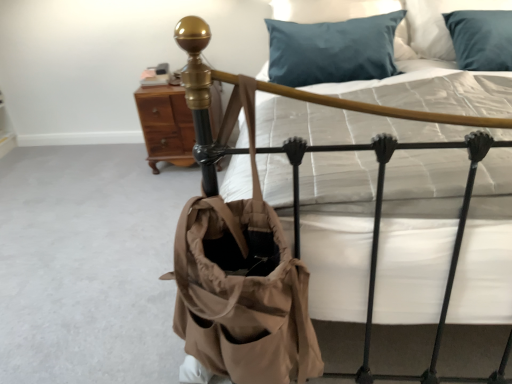
Question: Is brown wood nightstand at upper left inside the boundaries of white quilted mattress at center, or outside?

Choices:
 (A) inside
 (B) outside

Answer: (B)

Question: Considering the positions of brown wood nightstand at upper left and white quilted mattress at center in the image, is brown wood nightstand at upper left taller or shorter than white quilted mattress at center?

Choices:
 (A) tall
 (B) short

Answer: (B)

Question: Based on their relative distances, which object is farther from the tan canvas tote at center?

Choices:
 (A) white quilted mattress at center
 (B) teal satin pillow at upper center
 (C) brown wood nightstand at upper left

Answer: (C)

Question: Estimate the real-world distances between objects in this image. Which object is farther from the teal satin pillow at upper center?

Choices:
 (A) brown wood nightstand at upper left
 (B) tan canvas tote at center
 (C) white quilted mattress at center

Answer: (B)